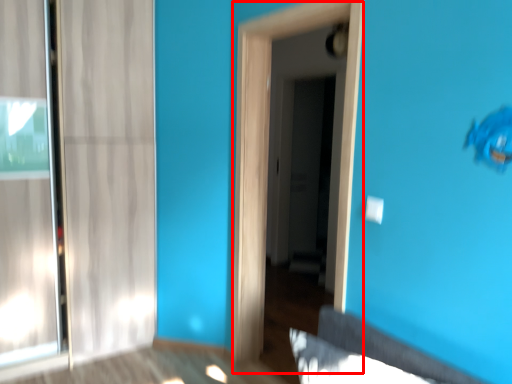
Question: Observing the image, what is the correct spatial positioning of screen door (annotated by the red box) in reference to screen door?

Choices:
 (A) right
 (B) left

Answer: (B)